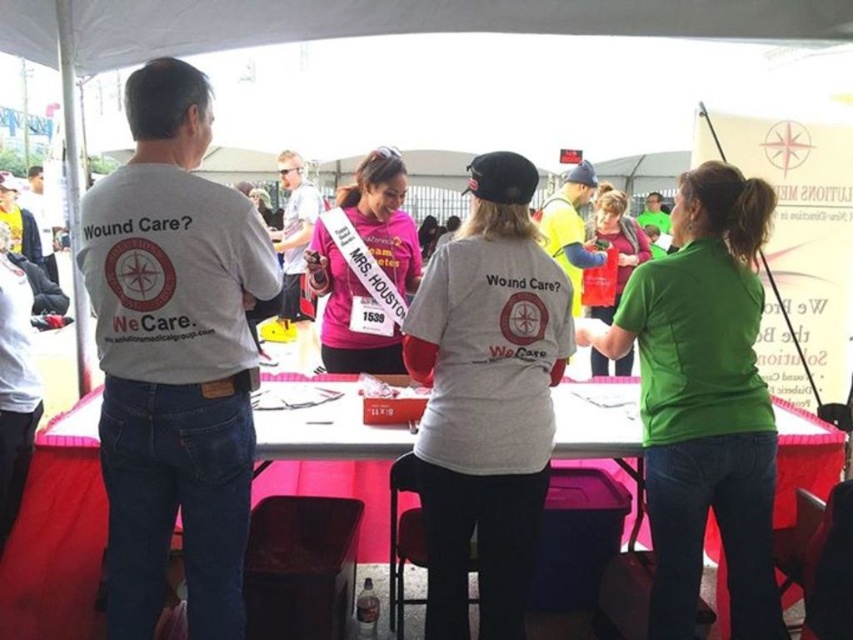
Question: Can you confirm if white cotton shirt at left is smaller than white matte shirt at center?

Choices:
 (A) yes
 (B) no

Answer: (B)

Question: Estimate the real-world distances between objects in this image. Which object is farther from the white plastic table at center?

Choices:
 (A) white cotton shirt at left
 (B) green matte shirt at center
 (C) matte pink shirt at center

Answer: (C)

Question: Is white cotton shirt at left smaller than green matte shirt at center?

Choices:
 (A) no
 (B) yes

Answer: (A)

Question: From the image, what is the correct spatial relationship of white cotton shirt at left in relation to green matte shirt at center?

Choices:
 (A) below
 (B) above

Answer: (B)

Question: Which point is closer to the camera taking this photo?

Choices:
 (A) (468, 547)
 (B) (405, 289)

Answer: (A)

Question: Which point is farther from the camera taking this photo?

Choices:
 (A) (82, 518)
 (B) (294, 244)

Answer: (B)